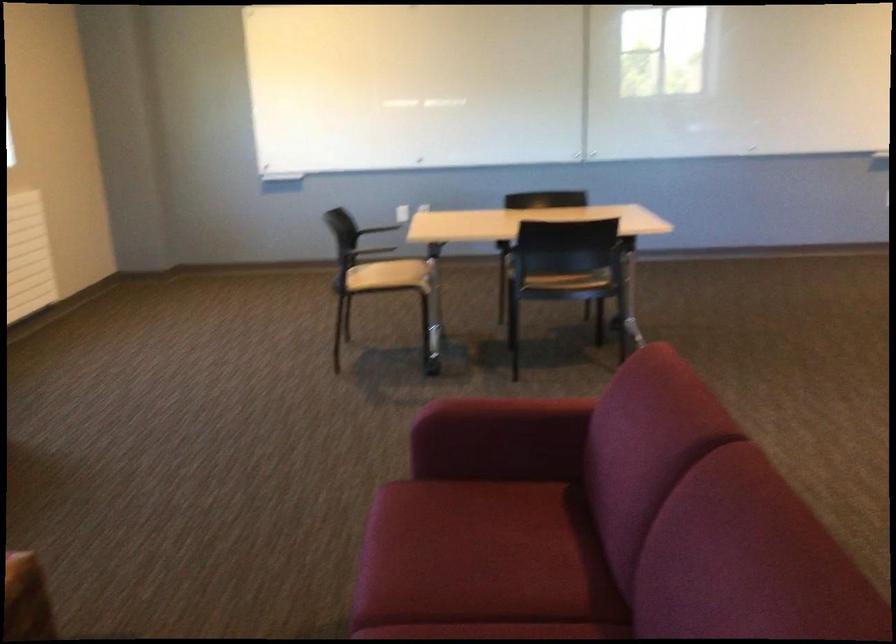
Find where to resting arm the black chair armrest. Please return your answer as a coordinate pair (x, y).

(359, 250)